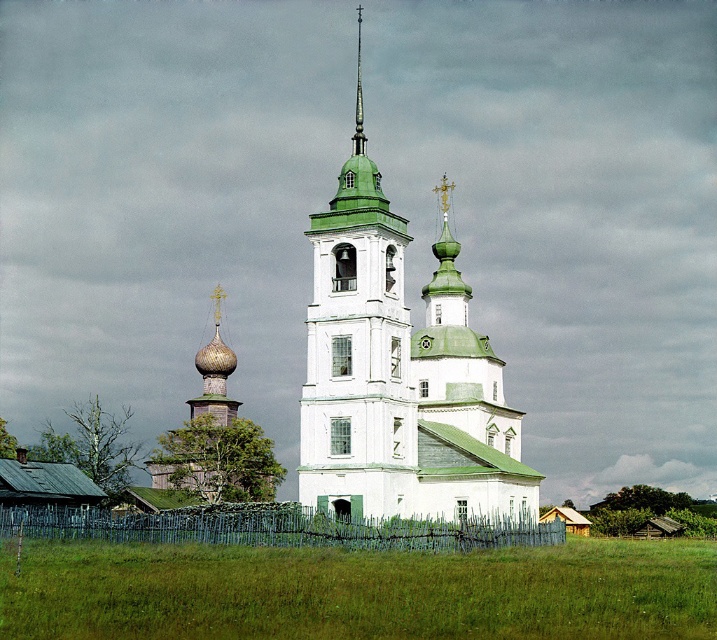
Based on the photo, you are standing in the middle of a rural field looking towards the traditional Russian Orthodox church and its bell tower. According to the scene, which object is closer to you between the white painted wood church at center and the green wooden bell tower at center?

The white painted wood church at center is closer to you since it is positioned in front of the green wooden bell tower at center.

You are a tourist visiting the church and want to take a photo of the white painted wood church at center and the green wooden fence at lower center. Which object will appear larger in your photo?

The white painted wood church at center will appear larger in the photo because it has a greater height compared to the green wooden fence at lower center.